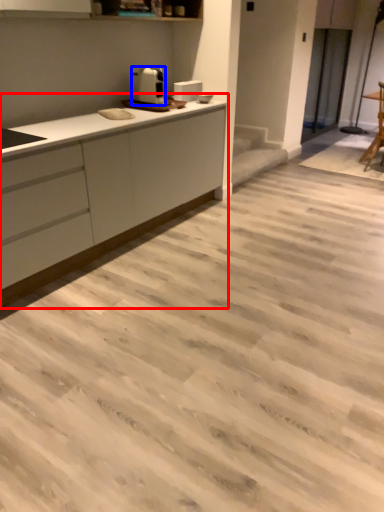
Question: Among these objects, which one is nearest to the camera, countertop (highlighted by a red box) or home appliance (highlighted by a blue box)?

Choices:
 (A) countertop
 (B) home appliance

Answer: (A)